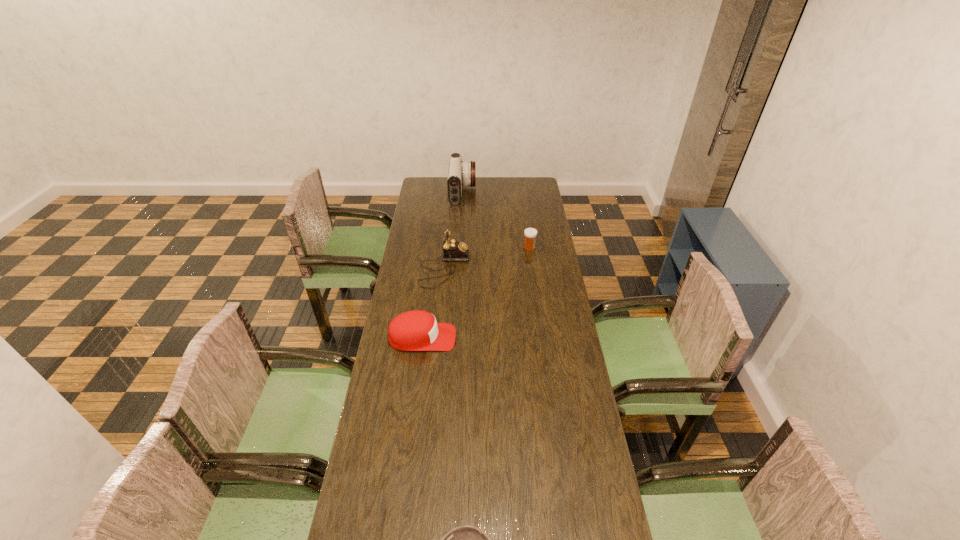
The image size is (960, 540). Find the location of `the farthest object`. the farthest object is located at coordinates (461, 173).

Identify the location of the tallest object. The image size is (960, 540). (461, 173).

This screenshot has height=540, width=960. In order to click on telephone in this screenshot , I will do `click(453, 250)`.

I want to click on the fourth farthest object, so click(x=417, y=330).

At what (x,y) coordinates should I click in order to perform the action: click on the rightmost object. Please return your answer as a coordinate pair (x, y). This screenshot has width=960, height=540. Looking at the image, I should click on (530, 234).

This screenshot has height=540, width=960. Identify the location of vacant area located on the surface of the camcorder. (525, 192).

This screenshot has height=540, width=960. I want to click on free location located on the dial of the telephone, so click(x=522, y=268).

I want to click on vacant space located 0.360m on the front-facing side of the fourth farthest object, so click(x=548, y=338).

Where is `vacant space located 0.110m on the back of the medicine`? This screenshot has height=540, width=960. vacant space located 0.110m on the back of the medicine is located at coordinates (527, 231).

At what (x,y) coordinates should I click in order to perform the action: click on object positioned at the far edge. Please return your answer as a coordinate pair (x, y). Looking at the image, I should click on (461, 173).